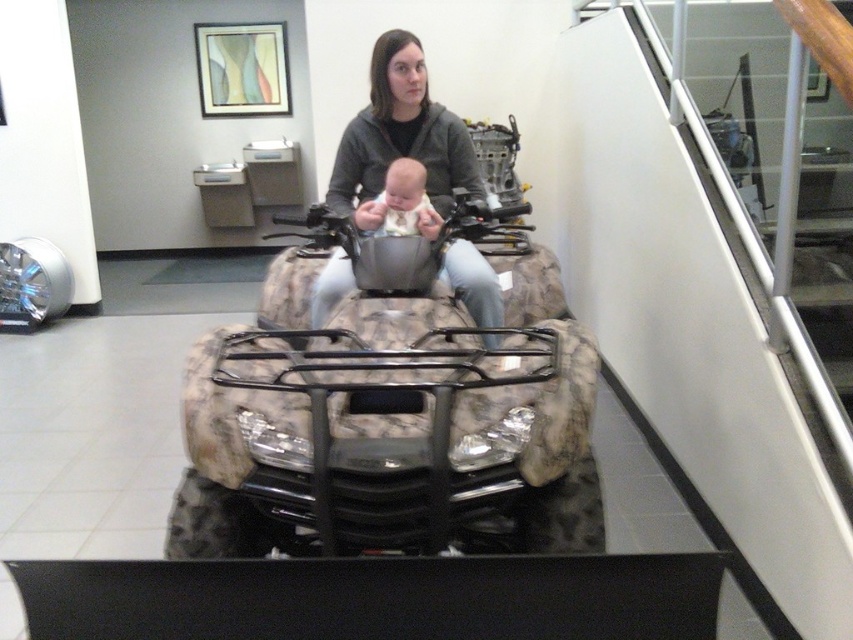
Between point (374, 140) and point (379, 195), which one is positioned in front?

Point (379, 195) is more forward.

Does point (335, 188) come farther from viewer compared to point (383, 205)?

Yes, it is.

You are a GUI agent. You are given a task and a screenshot of the screen. Output one action in this format:
    pyautogui.click(x=<x>, y=<y>)
    Task: Click on the matte gray hoodie at center
    The width and height of the screenshot is (853, 640).
    Given the screenshot: What is the action you would take?
    pyautogui.click(x=399, y=138)

Does camouflage fabric baby carriage at center have a greater height compared to soft white fabric baby at center?

Yes, camouflage fabric baby carriage at center is taller than soft white fabric baby at center.

Can you confirm if camouflage fabric baby carriage at center is smaller than soft white fabric baby at center?

No.

You are a GUI agent. You are given a task and a screenshot of the screen. Output one action in this format:
    pyautogui.click(x=<x>, y=<y>)
    Task: Click on the camouflage fabric baby carriage at center
    The width and height of the screenshot is (853, 640).
    Given the screenshot: What is the action you would take?
    pyautogui.click(x=387, y=422)

Can you confirm if camouflage fabric baby carriage at center is wider than matte gray hoodie at center?

Correct, the width of camouflage fabric baby carriage at center exceeds that of matte gray hoodie at center.

This screenshot has width=853, height=640. What do you see at coordinates (387, 422) in the screenshot? I see `camouflage fabric baby carriage at center` at bounding box center [387, 422].

The image size is (853, 640). Find the location of `camouflage fabric baby carriage at center`. camouflage fabric baby carriage at center is located at coordinates pos(387,422).